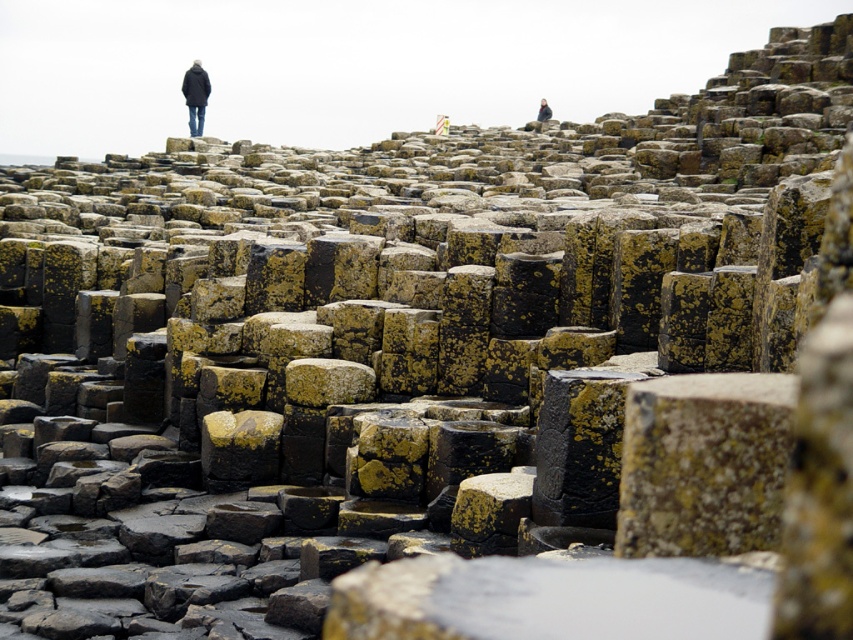
Looking at this image, you are a hiker standing at the Giant Causeway and you see a black matte coat at upper left and a dark gray jacket at upper center. Which item is nearer to you?

The black matte coat at upper left is closer to the viewer than the dark gray jacket at upper center, so the black matte coat at upper left is nearer to you.

You are standing at the Giant Causeway and want to take a photo that includes both the point at coordinates (190, 92) and the point at (540, 108). Which point will appear larger in your photo?

The point at coordinates (190, 92) will appear larger in the photo because it is closer to the camera than the point at (540, 108).

You are a hiker preparing to walk across the hexagonal basalt columns at the Giant Causeway. You see a black matte coat at upper left and a dark gray jacket at upper center. Which clothing item would be more suitable to wear if you want to stay warm?

The dark gray jacket at upper center is thicker than the black matte coat at upper left, making it more suitable for staying warm during your hike.